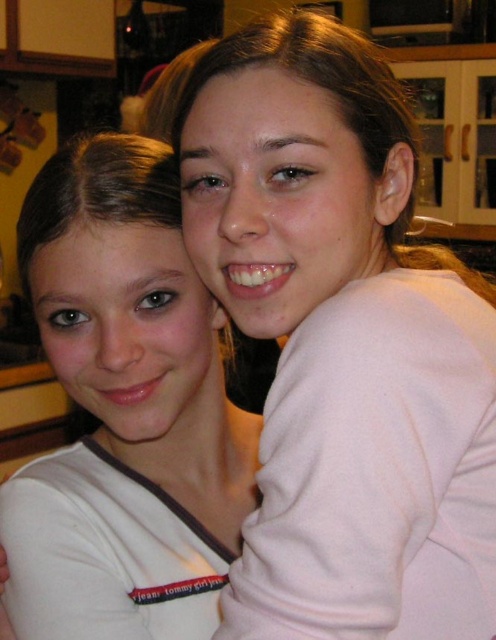
Question: Where is pink matte sweater at upper right located in relation to white matte shirt at center in the image?

Choices:
 (A) right
 (B) left

Answer: (A)

Question: Which of the following is the closest to the observer?

Choices:
 (A) (74, 525)
 (B) (230, 104)

Answer: (B)

Question: Does pink matte sweater at upper right appear under white matte shirt at center?

Choices:
 (A) yes
 (B) no

Answer: (B)

Question: Is pink matte sweater at upper right above white matte shirt at center?

Choices:
 (A) yes
 (B) no

Answer: (A)